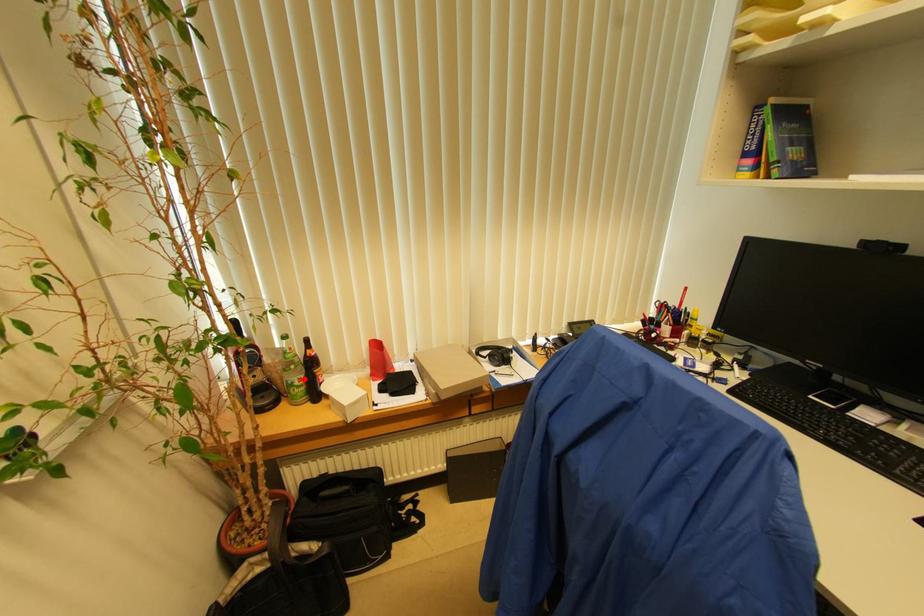
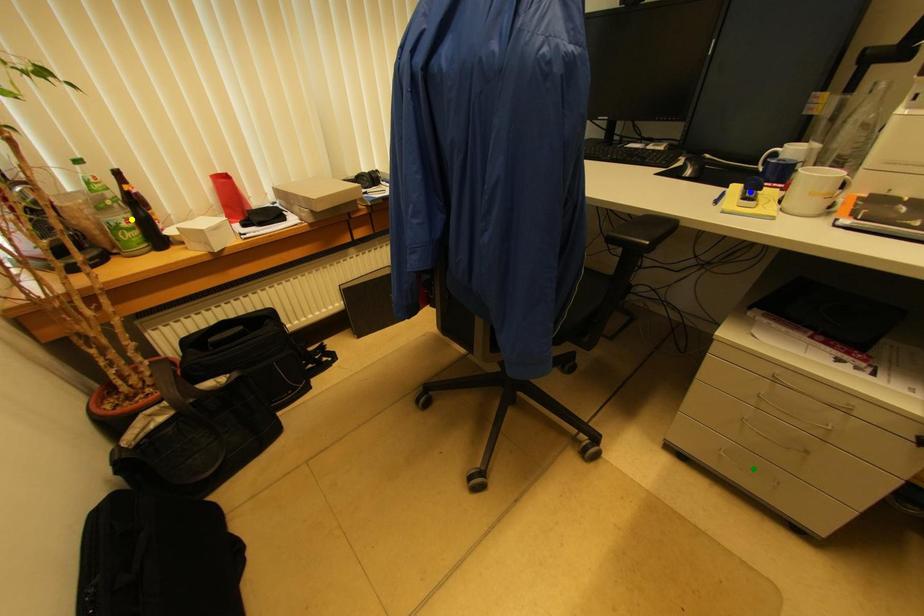
Question: I am providing you with two images of the same scene from different viewpoints. A red point is marked on the first image. You are given multiple points on the second image. Which mark in image 2 goes with the point in image 1?

Choices:
 (A) yellow point
 (B) blue point
 (C) green point

Answer: (A)